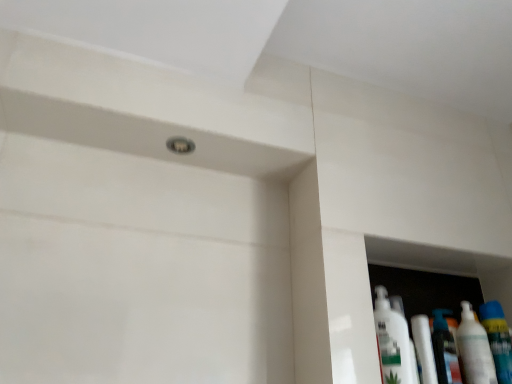
This screenshot has height=384, width=512. What do you see at coordinates (474, 350) in the screenshot? I see `white glossy bottle at right, the 2th cleaning product viewed from the left` at bounding box center [474, 350].

What do you see at coordinates (445, 350) in the screenshot? The height and width of the screenshot is (384, 512). I see `white glossy bottle at right, which is the first mouthwash in left-to-right order` at bounding box center [445, 350].

Find the location of a particular element. white glossy tube at lower right is located at coordinates pos(424,349).

The image size is (512, 384). Identify the location of white glossy bottle at right, the 2th cleaning product viewed from the left. (474, 350).

From the image's perspective, who appears lower, translucent plastic mouthwash at right, the second mouthwash positioned from the left, or white glossy bottle at lower right, acting as the 2th cleaning product starting from the right?

translucent plastic mouthwash at right, the second mouthwash positioned from the left.

From a real-world perspective, which object stands above the other?

In real-world perspective, white glossy bottle at lower right, which appears as the 1th cleaning product when viewed from the left, is above.

Is translucent plastic mouthwash at right, the second mouthwash positioned from the left, wider than white glossy bottle at lower right, acting as the 2th cleaning product starting from the right?

Incorrect, the width of translucent plastic mouthwash at right, the second mouthwash positioned from the left, does not surpass that of white glossy bottle at lower right, acting as the 2th cleaning product starting from the right.

From a real-world perspective, is white glossy tube at lower right physically below white glossy bottle at lower right, which appears as the 1th cleaning product when viewed from the left?

Yes, from a real-world perspective, white glossy tube at lower right is under white glossy bottle at lower right, which appears as the 1th cleaning product when viewed from the left.

Considering the positions of objects white glossy tube at lower right and white glossy bottle at lower right, acting as the 2th cleaning product starting from the right, in the image provided, who is more to the right, white glossy tube at lower right or white glossy bottle at lower right, acting as the 2th cleaning product starting from the right,?

From the viewer's perspective, white glossy tube at lower right appears more on the right side.

Is white glossy tube at lower right spatially inside white glossy bottle at lower right, acting as the 2th cleaning product starting from the right, or outside of it?

white glossy tube at lower right is outside white glossy bottle at lower right, acting as the 2th cleaning product starting from the right.

Considering the relative sizes of white glossy tube at lower right and white glossy bottle at lower right, acting as the 2th cleaning product starting from the right, in the image provided, is white glossy tube at lower right thinner than white glossy bottle at lower right, acting as the 2th cleaning product starting from the right,?

Yes.

Is translucent plastic mouthwash at right, placed as the first mouthwash when sorted from right to left, oriented away from white glossy tube at lower right?

No, translucent plastic mouthwash at right, placed as the first mouthwash when sorted from right to left,'s orientation is not away from white glossy tube at lower right.

Which object is thinner, translucent plastic mouthwash at right, placed as the first mouthwash when sorted from right to left, or white glossy tube at lower right?

white glossy tube at lower right.

Locate an element on the screen. The width and height of the screenshot is (512, 384). toiletry below the translucent plastic mouthwash at right, the second mouthwash positioned from the left (from a real-world perspective) is located at coordinates (424, 349).

Is white glossy bottle at right, which is the first mouthwash in left-to-right order, smaller than white glossy bottle at right, the 2th cleaning product viewed from the left?

Yes, white glossy bottle at right, which is the first mouthwash in left-to-right order, is smaller than white glossy bottle at right, the 2th cleaning product viewed from the left.

This screenshot has height=384, width=512. Find the location of `the 2nd mouthwash behind the white glossy bottle at right, the 2th cleaning product viewed from the left, counting from the anchor's position`. the 2nd mouthwash behind the white glossy bottle at right, the 2th cleaning product viewed from the left, counting from the anchor's position is located at coordinates pyautogui.click(x=445, y=350).

Which point is more forward, (442, 358) or (481, 356)?

The point (442, 358) is closer.

Is white glossy bottle at right, acting as the second mouthwash starting from the right, to the left of white glossy bottle at right, the 2th cleaning product viewed from the left, from the viewer's perspective?

Indeed, white glossy bottle at right, acting as the second mouthwash starting from the right, is positioned on the left side of white glossy bottle at right, the 2th cleaning product viewed from the left.

From a real-world perspective, is white glossy tube at lower right positioned over translucent plastic mouthwash at right, placed as the first mouthwash when sorted from right to left, based on gravity?

Incorrect, from a real-world perspective, white glossy tube at lower right is lower than translucent plastic mouthwash at right, placed as the first mouthwash when sorted from right to left.

From the image's perspective, would you say white glossy tube at lower right is shown under translucent plastic mouthwash at right, placed as the first mouthwash when sorted from right to left?

No, from the image's perspective, white glossy tube at lower right is not beneath translucent plastic mouthwash at right, placed as the first mouthwash when sorted from right to left.

Is white glossy tube at lower right in front of translucent plastic mouthwash at right, placed as the first mouthwash when sorted from right to left?

Yes, the depth of white glossy tube at lower right is less than that of translucent plastic mouthwash at right, placed as the first mouthwash when sorted from right to left.

Which point is more distant from viewer, (429, 382) or (501, 338)?

Positioned behind is point (501, 338).

In terms of height, does white glossy bottle at right, which is the first mouthwash in left-to-right order, look taller or shorter compared to translucent plastic mouthwash at right, the second mouthwash positioned from the left?

white glossy bottle at right, which is the first mouthwash in left-to-right order, is shorter than translucent plastic mouthwash at right, the second mouthwash positioned from the left.

Is white glossy bottle at right, which is the first mouthwash in left-to-right order, turned away from translucent plastic mouthwash at right, placed as the first mouthwash when sorted from right to left?

No, white glossy bottle at right, which is the first mouthwash in left-to-right order, is not facing the opposite direction of translucent plastic mouthwash at right, placed as the first mouthwash when sorted from right to left.

Is white glossy bottle at right, which is the first mouthwash in left-to-right order, closer to the viewer compared to translucent plastic mouthwash at right, placed as the first mouthwash when sorted from right to left?

That is False.

Is the surface of white glossy bottle at right, acting as the second mouthwash starting from the right, in direct contact with white glossy tube at lower right?

Yes, the surface of white glossy bottle at right, acting as the second mouthwash starting from the right, is in contact with white glossy tube at lower right.

Is white glossy bottle at right, which is the first mouthwash in left-to-right order, located outside white glossy tube at lower right?

white glossy bottle at right, which is the first mouthwash in left-to-right order, is positioned outside white glossy tube at lower right.

Is white glossy bottle at right, which is the first mouthwash in left-to-right order, oriented towards white glossy tube at lower right?

No, white glossy bottle at right, which is the first mouthwash in left-to-right order, is not turned towards white glossy tube at lower right.

Locate an element on the screen. This screenshot has width=512, height=384. cleaning product that is the 2nd object to the left of the translucent plastic mouthwash at right, placed as the first mouthwash when sorted from right to left, starting at the anchor is located at coordinates click(x=393, y=342).

The height and width of the screenshot is (384, 512). What are the coordinates of `toiletry that appears below the white glossy bottle at lower right, acting as the 2th cleaning product starting from the right (from a real-world perspective)` in the screenshot? It's located at (424, 349).

Estimate the real-world distances between objects in this image. Which object is closer to translucent plastic mouthwash at right, placed as the first mouthwash when sorted from right to left, white glossy bottle at lower right, which appears as the 1th cleaning product when viewed from the left, or white glossy bottle at right, acting as the second mouthwash starting from the right?

white glossy bottle at right, acting as the second mouthwash starting from the right, is closer to translucent plastic mouthwash at right, placed as the first mouthwash when sorted from right to left.

When comparing their distances from white glossy tube at lower right, does translucent plastic mouthwash at right, placed as the first mouthwash when sorted from right to left, or white glossy bottle at lower right, which appears as the 1th cleaning product when viewed from the left, seem further?

The object further to white glossy tube at lower right is translucent plastic mouthwash at right, placed as the first mouthwash when sorted from right to left.

Looking at the image, which one is located closer to translucent plastic mouthwash at right, the second mouthwash positioned from the left, white glossy bottle at right, the 1th cleaning product when ordered from right to left, or white glossy tube at lower right?

white glossy bottle at right, the 1th cleaning product when ordered from right to left, is positioned closer to the anchor translucent plastic mouthwash at right, the second mouthwash positioned from the left.

Looking at the image, which one is located further to white glossy bottle at right, the 2th cleaning product viewed from the left, white glossy bottle at right, which is the first mouthwash in left-to-right order, or white glossy tube at lower right?

white glossy tube at lower right lies further to white glossy bottle at right, the 2th cleaning product viewed from the left, than the other object.

When comparing their distances from white glossy bottle at right, acting as the second mouthwash starting from the right, does white glossy bottle at right, the 1th cleaning product when ordered from right to left, or white glossy tube at lower right seem further?

Among the two, white glossy bottle at right, the 1th cleaning product when ordered from right to left, is located further to white glossy bottle at right, acting as the second mouthwash starting from the right.

Looking at the image, which one is located further to translucent plastic mouthwash at right, the second mouthwash positioned from the left, white glossy tube at lower right or white glossy bottle at right, the 1th cleaning product when ordered from right to left?

white glossy tube at lower right lies further to translucent plastic mouthwash at right, the second mouthwash positioned from the left, than the other object.

Based on their spatial positions, is white glossy bottle at lower right, acting as the 2th cleaning product starting from the right, or translucent plastic mouthwash at right, the second mouthwash positioned from the left, closer to white glossy tube at lower right?

white glossy bottle at lower right, acting as the 2th cleaning product starting from the right, lies closer to white glossy tube at lower right than the other object.

Which object lies further to the anchor point white glossy tube at lower right, white glossy bottle at right, which is the first mouthwash in left-to-right order, or translucent plastic mouthwash at right, the second mouthwash positioned from the left?

Based on the image, translucent plastic mouthwash at right, the second mouthwash positioned from the left, appears to be further to white glossy tube at lower right.

You are a GUI agent. You are given a task and a screenshot of the screen. Output one action in this format:
    pyautogui.click(x=<x>, y=<y>)
    Task: Click on the toiletry between white glossy bottle at lower right, acting as the 2th cleaning product starting from the right, and translucent plastic mouthwash at right, the second mouthwash positioned from the left, from left to right
    
    Given the screenshot: What is the action you would take?
    pyautogui.click(x=424, y=349)

Find the location of a particular element. The width and height of the screenshot is (512, 384). toiletry between white glossy bottle at lower right, acting as the 2th cleaning product starting from the right, and white glossy bottle at right, acting as the second mouthwash starting from the right is located at coordinates (424, 349).

Image resolution: width=512 pixels, height=384 pixels. What are the coordinates of `cleaning product located between white glossy tube at lower right and translucent plastic mouthwash at right, placed as the first mouthwash when sorted from right to left, in the left-right direction` in the screenshot? It's located at (474, 350).

What are the coordinates of `mouthwash between white glossy bottle at lower right, acting as the 2th cleaning product starting from the right, and translucent plastic mouthwash at right, placed as the first mouthwash when sorted from right to left, in the horizontal direction` in the screenshot? It's located at (445, 350).